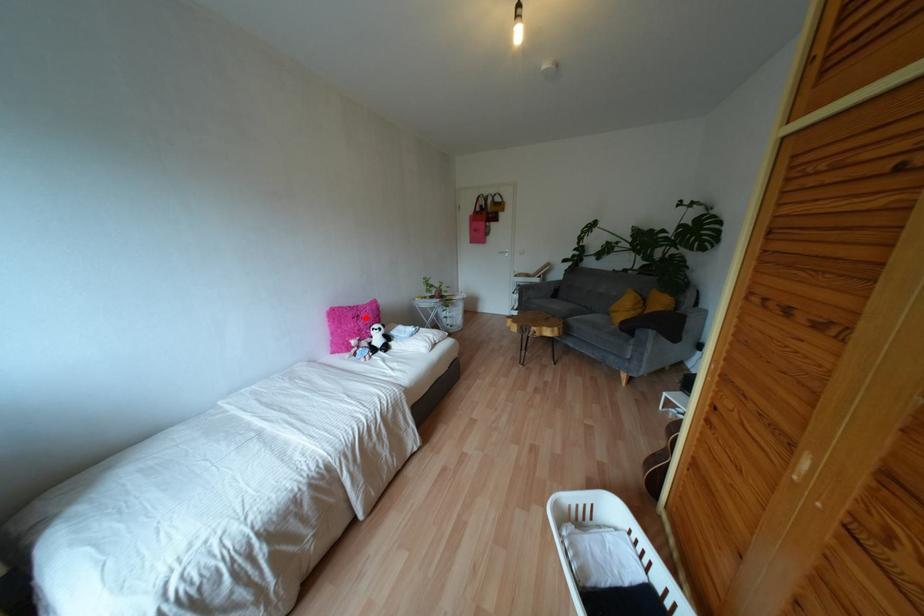
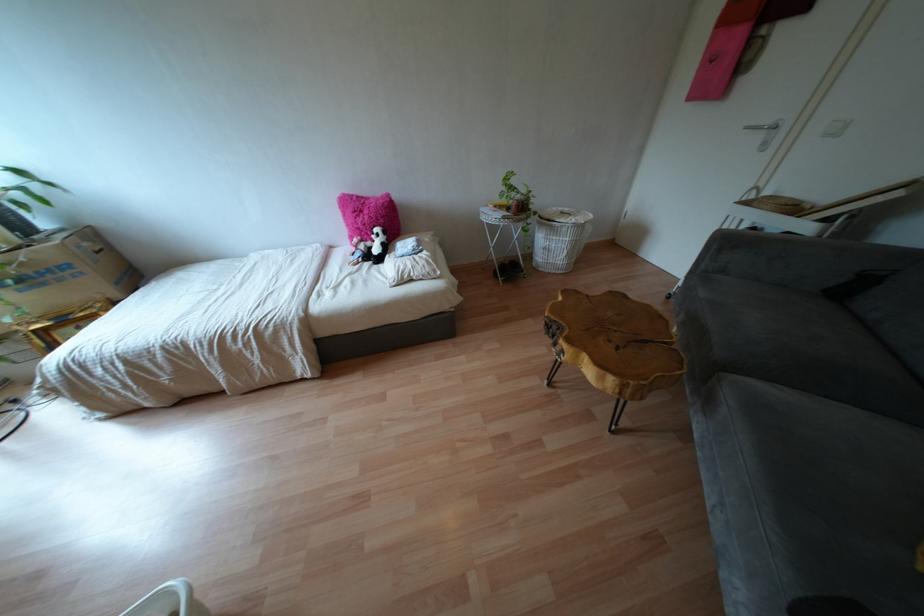
In the second image, find the point that corresponds to the highlighted location in the first image.

(365, 217)